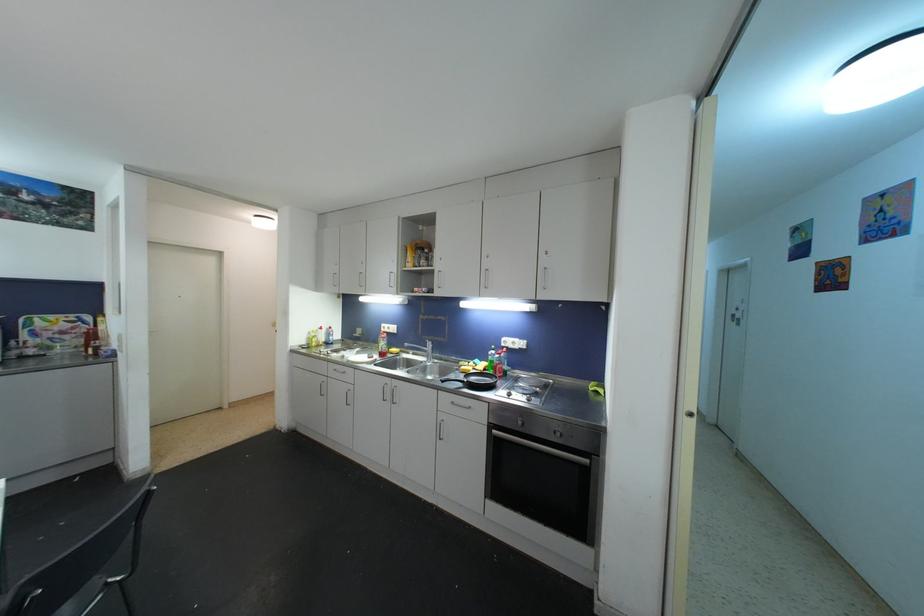
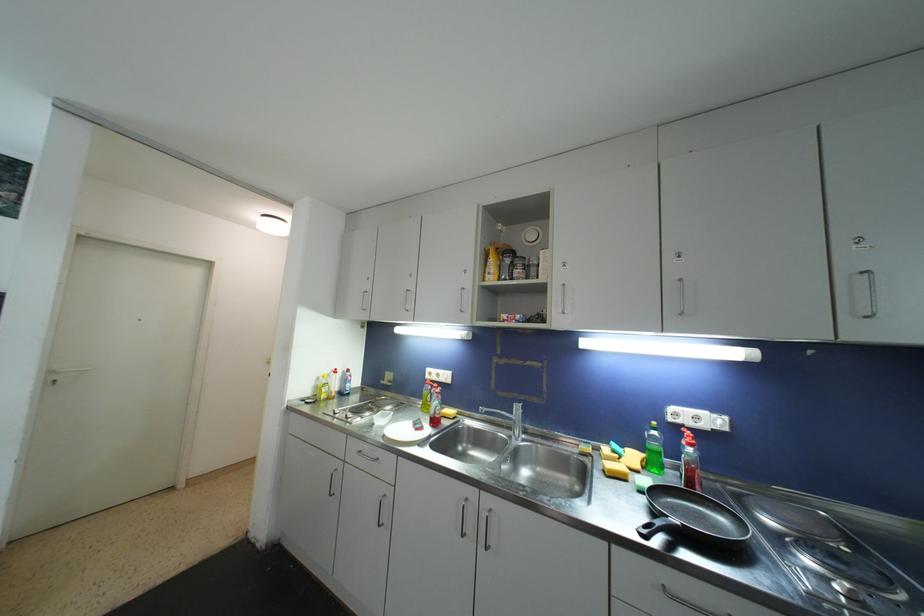
Find the pixel in the second image that matches the point at 518,349 in the first image.

(708, 429)